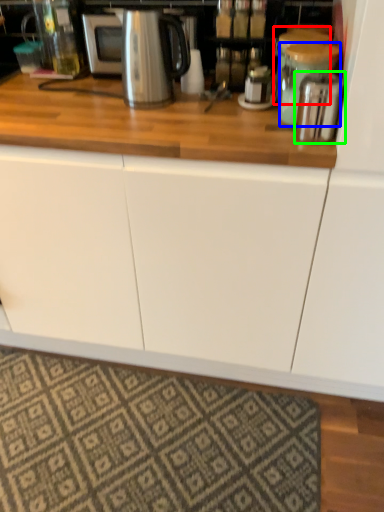
Question: Which object is positioned farthest from appliance (highlighted by a red box)? Select from appliance (highlighted by a blue box) and appliance (highlighted by a green box).

Choices:
 (A) appliance
 (B) appliance

Answer: (B)